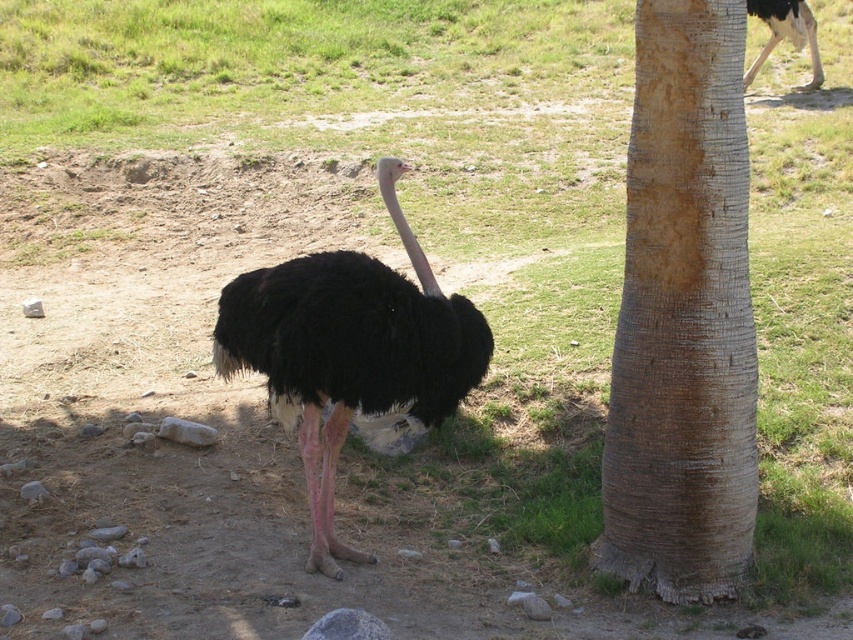
Consider the image. You are a birdwatcher observing the black feathered ostrich at center and the black feathered head at center in the scene. Which object is taller?

The black feathered ostrich at center is much taller than the black feathered head at center.

You are an ornithologist observing an ostrich in its natural habitat. You notice the brown rough bark at right and the black feathered ostrich at center. Which object is taller?

The brown rough bark at right is taller than the black feathered ostrich at center according to the description.